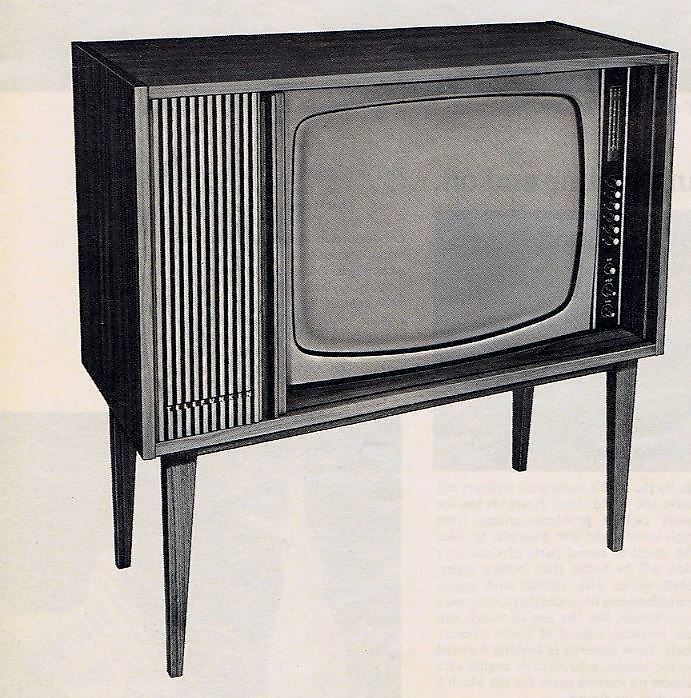
Locate an element on the screen. The width and height of the screenshot is (691, 698). screen is located at coordinates (477, 213).